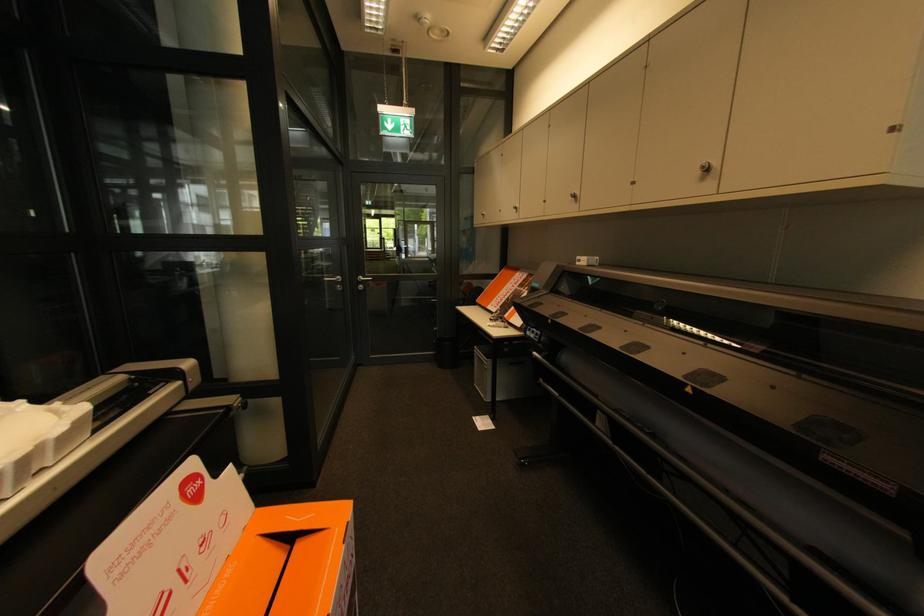
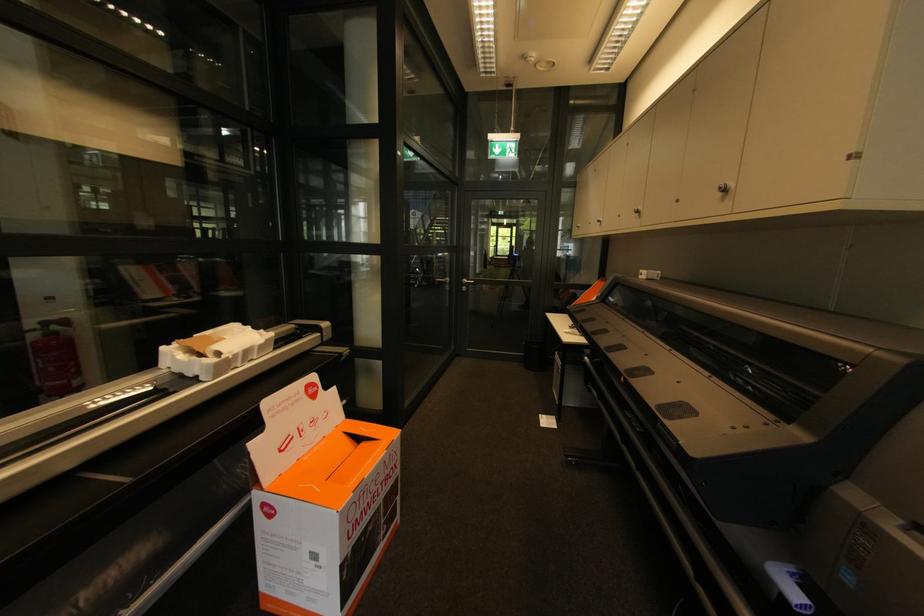
In the second image, find the point that corresponds to (435,352) in the first image.

(526, 354)